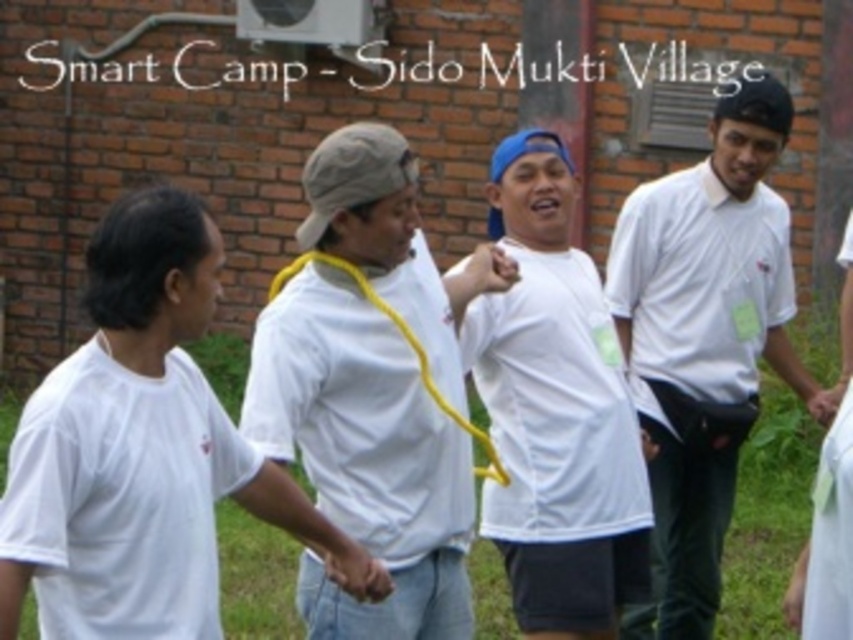
Who is taller, white smooth shirt at center or white matte t-shirt at center?

white smooth shirt at center is taller.

Is white smooth shirt at center further to camera compared to white matte t-shirt at center?

Yes, it is behind white matte t-shirt at center.

Consider the image. Who is more forward, (715, 358) or (604, 417)?

Point (604, 417) is more forward.

Image resolution: width=853 pixels, height=640 pixels. What are the coordinates of `white smooth shirt at center` in the screenshot? It's located at (704, 340).

Is white matte shirt at center to the right of white matte t-shirt at center from the viewer's perspective?

No, white matte shirt at center is not to the right of white matte t-shirt at center.

Which is in front, point (282, 356) or point (520, 172)?

Positioned in front is point (282, 356).

Where is `white matte shirt at center`? The height and width of the screenshot is (640, 853). white matte shirt at center is located at coordinates (364, 456).

Does white matte shirt at left appear on the left side of white smooth shirt at center?

Indeed, white matte shirt at left is positioned on the left side of white smooth shirt at center.

Who is positioned more to the left, white matte shirt at left or white smooth shirt at center?

From the viewer's perspective, white matte shirt at left appears more on the left side.

Is point (196, 330) more distant than point (668, 209)?

No.

What are the coordinates of `white matte shirt at left` in the screenshot? It's located at (141, 451).